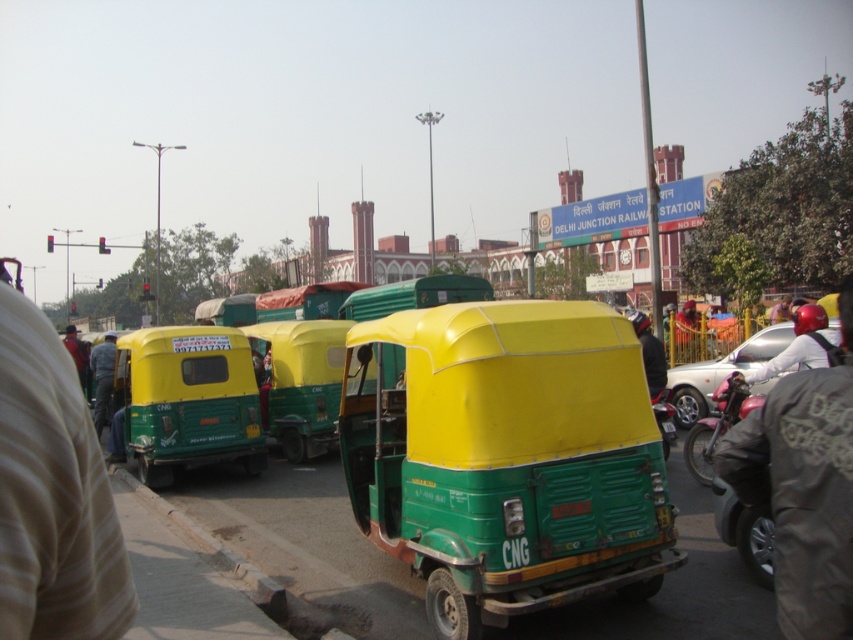
You are standing at the Delhi Junction Railway Station and want to take a photo of the auto rickshaws parked in front of the station. You notice two points marked on the ground at coordinates point (660, 404) and point (86, 371). Which point is closer to your camera position?

Point (660, 404) is closer to the camera than point (86, 371).